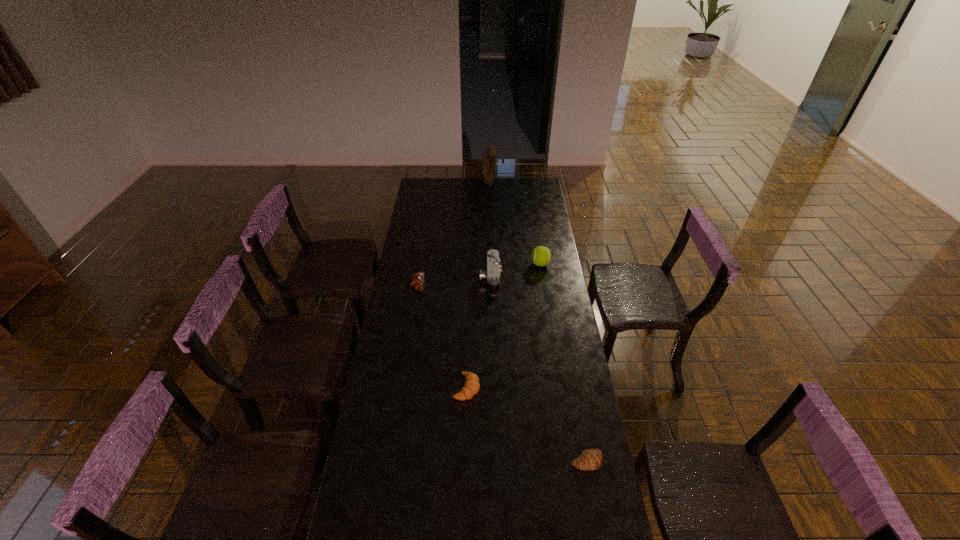
Locate an element on the screen. Image resolution: width=960 pixels, height=540 pixels. figurine is located at coordinates (489, 156).

Where is `the tallest object`? The height and width of the screenshot is (540, 960). the tallest object is located at coordinates (489, 156).

Where is `camera`? The image size is (960, 540). camera is located at coordinates (x=492, y=274).

This screenshot has width=960, height=540. Find the location of `tennis ball`. tennis ball is located at coordinates (541, 256).

I want to click on the second farthest crescent roll, so click(x=471, y=387).

Identify the location of the second crescent roll from right to left. (471, 387).

In order to click on the farthest crescent roll in this screenshot , I will do `click(417, 279)`.

Locate an element on the screen. Image resolution: width=960 pixels, height=540 pixels. the leftmost object is located at coordinates (417, 279).

Image resolution: width=960 pixels, height=540 pixels. I want to click on the rightmost crescent roll, so click(x=590, y=459).

This screenshot has height=540, width=960. Find the location of `the nearest crescent roll`. the nearest crescent roll is located at coordinates (590, 459).